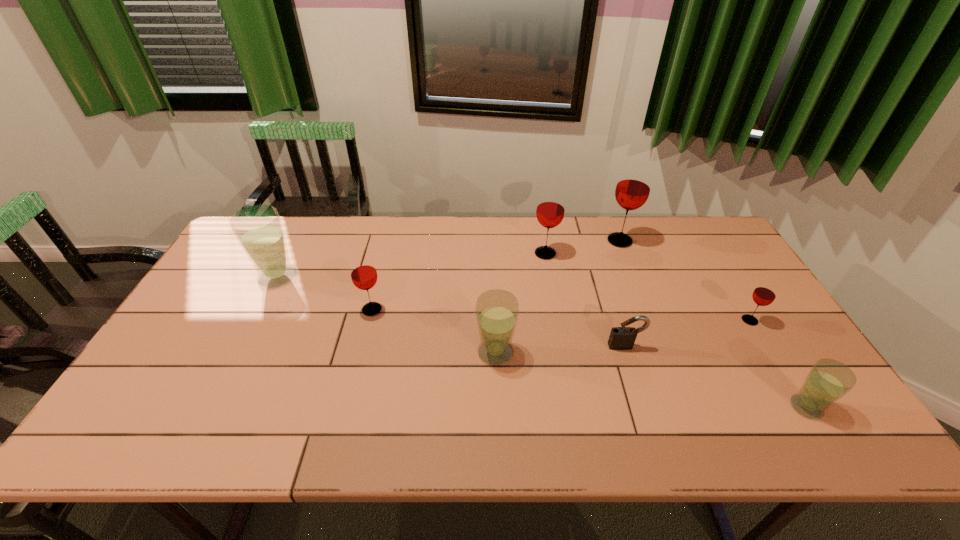
The height and width of the screenshot is (540, 960). I want to click on vacant space located on the back of the rightmost blue glass, so click(x=786, y=375).

The image size is (960, 540). I want to click on vacant region located 0.070m with the keyhole on the front of the padlock, so click(634, 372).

Where is `object present at the near edge`? This screenshot has width=960, height=540. object present at the near edge is located at coordinates (828, 380).

Identify the location of object located in the left edge section of the desktop. (258, 229).

The width and height of the screenshot is (960, 540). I want to click on object that is at the near right corner, so click(x=828, y=380).

In the image, there is a desktop. Identify the location of free space at the far edge. (325, 223).

The image size is (960, 540). Identify the location of vacant space at the left edge of the desktop. (180, 345).

Find the location of a particular element. The image size is (960, 540). free region at the right edge of the desktop is located at coordinates (747, 346).

Where is `free space at the far right corner of the desktop`? free space at the far right corner of the desktop is located at coordinates (x=730, y=250).

Locate an element on the screen. Image resolution: width=960 pixels, height=540 pixels. empty space between the second glass from left to right and the fourth glass from left to right is located at coordinates (459, 282).